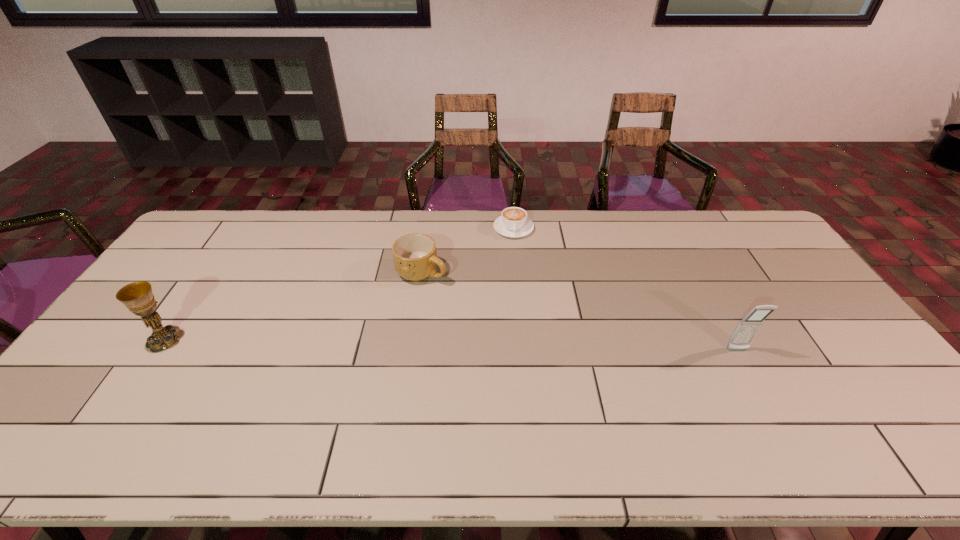
Where is `vacant area between the chalice and the shortest object`? This screenshot has height=540, width=960. vacant area between the chalice and the shortest object is located at coordinates (339, 284).

Select which object is the closest to the shortest object. Please provide its 2D coordinates. Your answer should be formatted as a tuple, i.e. [(x, y)], where the tuple contains the x and y coordinates of a point satisfying the conditions above.

[(415, 257)]

Find the location of `the closest object to the third object from right to left`. the closest object to the third object from right to left is located at coordinates (513, 222).

Identify the location of vacant space that satisfies the following two spatial constraints: 1. on the back side of the third tallest object; 2. on the right side of the chalice. This screenshot has height=540, width=960. (211, 272).

This screenshot has width=960, height=540. What are the coordinates of `vacant space that satisfies the following two spatial constraints: 1. on the back side of the farthest object; 2. on the left side of the third tallest object` in the screenshot? It's located at (428, 228).